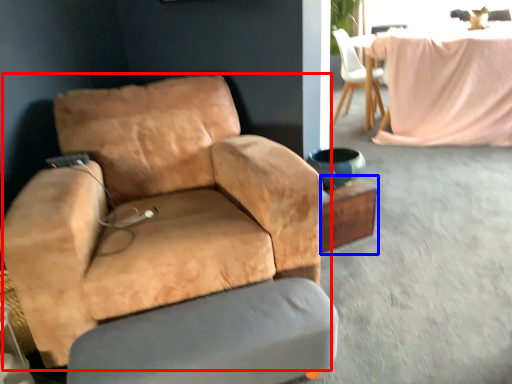
Question: Which object is further to the camera taking this photo, chair (highlighted by a red box) or side table (highlighted by a blue box)?

Choices:
 (A) chair
 (B) side table

Answer: (B)